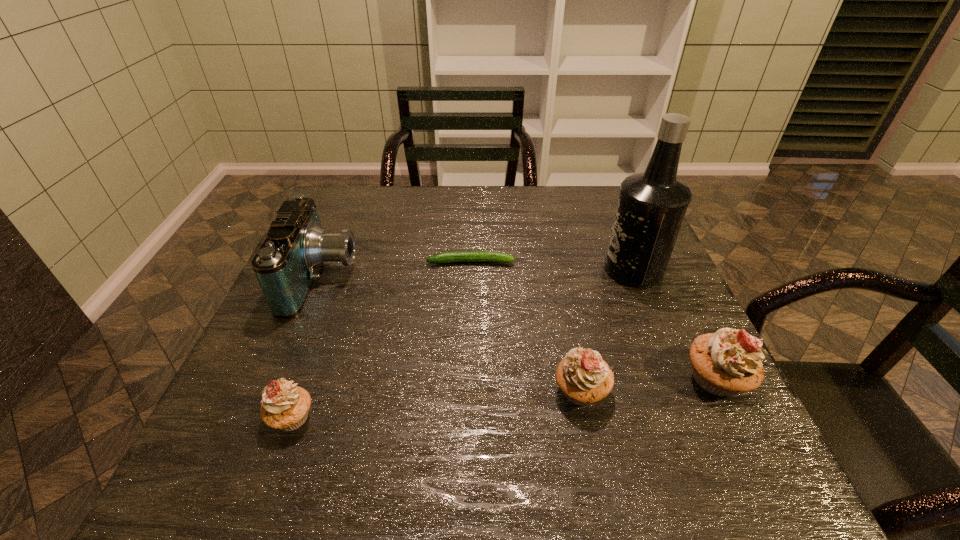
Identify the location of free space between the shortest object and the camcorder. (396, 270).

Locate an element on the screen. free space between the second tallest cupcake and the camcorder is located at coordinates (451, 335).

Identify the location of free space between the liquor and the fourth object from right to left. This screenshot has height=540, width=960. (552, 266).

You are a GUI agent. You are given a task and a screenshot of the screen. Output one action in this format:
    pyautogui.click(x=<x>, y=<y>)
    Task: Click on the empty location between the tallest cupcake and the fourth tallest object
    This screenshot has width=960, height=540.
    Given the screenshot: What is the action you would take?
    pyautogui.click(x=649, y=385)

Locate an element on the screen. The width and height of the screenshot is (960, 540). unoccupied area between the shortest cupcake and the liquor is located at coordinates (463, 343).

The height and width of the screenshot is (540, 960). Find the location of `free spot between the camcorder and the liquor`. free spot between the camcorder and the liquor is located at coordinates (478, 274).

The image size is (960, 540). Identify the location of empty space between the tallest object and the second tallest cupcake. (608, 330).

Find the location of a particular element. the fifth closest object to the zucchini is located at coordinates (285, 406).

Identify the location of object that is the fifth closest to the second shortest object. (725, 363).

The image size is (960, 540). In order to click on the second closest cupcake to the leftmost cupcake in this screenshot , I will do `click(725, 363)`.